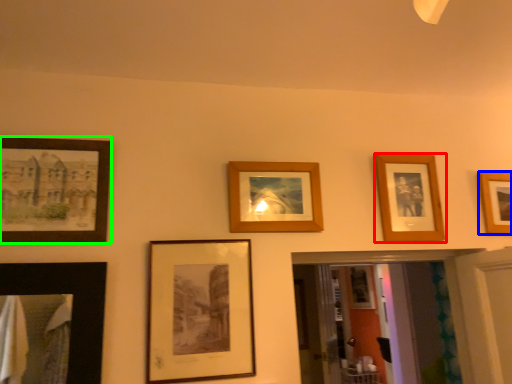
Question: Based on their relative distances, which object is nearer to picture frame (highlighted by a red box)? Choose from picture frame (highlighted by a blue box) and picture frame (highlighted by a green box).

Choices:
 (A) picture frame
 (B) picture frame

Answer: (A)